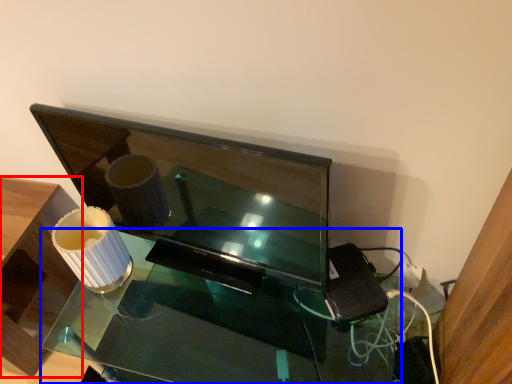
Question: Which point is closer to the camera, furniture (highlighted by a red box) or table (highlighted by a blue box)?

Choices:
 (A) furniture
 (B) table

Answer: (B)